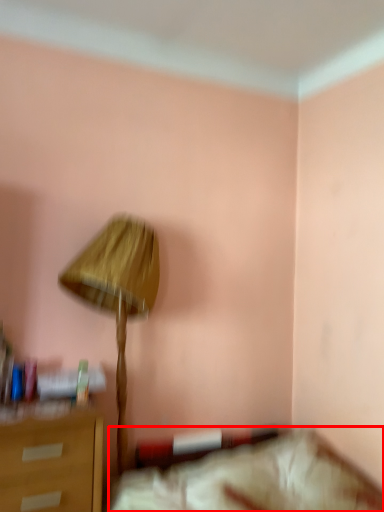
Question: From the image's perspective, where is furniture (annotated by the red box) located in relation to lamp in the image?

Choices:
 (A) above
 (B) below

Answer: (B)